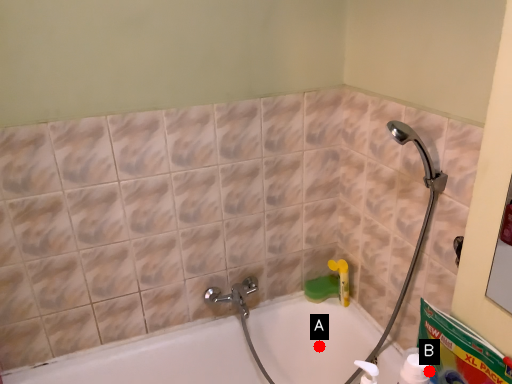
Question: Two points are circled on the image, labeled by A and B beside each circle. Which point is farther to the camera?

Choices:
 (A) A is further
 (B) B is further

Answer: (A)